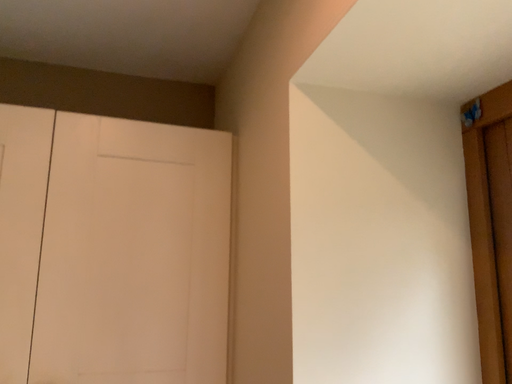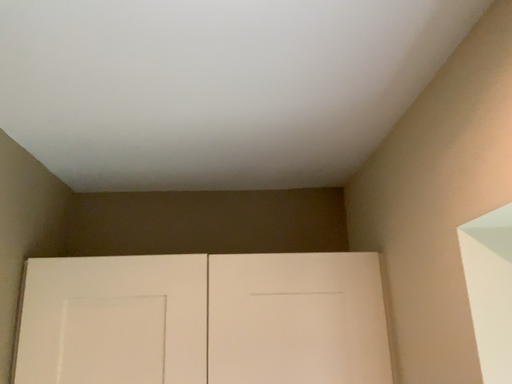
Question: How did the camera likely rotate when shooting the video?

Choices:
 (A) rotated left
 (B) rotated right

Answer: (A)